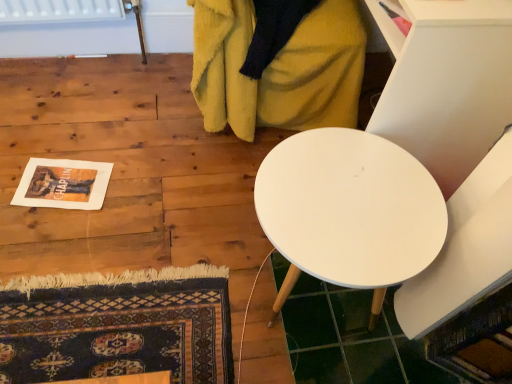
Question: From a real-world perspective, is white matte table at center beneath white matte table at upper right?

Choices:
 (A) yes
 (B) no

Answer: (A)

Question: Is white matte table at center turned away from white matte table at upper right?

Choices:
 (A) yes
 (B) no

Answer: (B)

Question: Does white matte table at center have a larger size compared to white matte table at upper right?

Choices:
 (A) yes
 (B) no

Answer: (B)

Question: Does white matte table at center appear on the right side of white matte table at upper right?

Choices:
 (A) yes
 (B) no

Answer: (B)

Question: Is white matte table at center positioned behind white matte table at upper right?

Choices:
 (A) yes
 (B) no

Answer: (B)

Question: Does point (448, 170) appear closer or farther from the camera than point (347, 49)?

Choices:
 (A) closer
 (B) farther

Answer: (A)

Question: From their relative heights in the image, would you say white matte table at upper right is taller or shorter than soft yellow blanket at upper center?

Choices:
 (A) tall
 (B) short

Answer: (A)

Question: From the image's perspective, is white matte table at upper right located above or below soft yellow blanket at upper center?

Choices:
 (A) above
 (B) below

Answer: (B)

Question: Considering the positions of white matte table at upper right and soft yellow blanket at upper center in the image, is white matte table at upper right wider or thinner than soft yellow blanket at upper center?

Choices:
 (A) thin
 (B) wide

Answer: (A)

Question: Is white matte table at center in front of or behind white matte table at upper right in the image?

Choices:
 (A) front
 (B) behind

Answer: (A)

Question: Is white matte table at center bigger or smaller than white matte table at upper right?

Choices:
 (A) big
 (B) small

Answer: (B)

Question: Is white matte table at center wider or thinner than white matte table at upper right?

Choices:
 (A) thin
 (B) wide

Answer: (A)

Question: Based on their positions, is white matte table at center located to the left or right of white matte table at upper right?

Choices:
 (A) right
 (B) left

Answer: (B)

Question: From a real-world perspective, is white matte table at upper right positioned above or below white matte table at center?

Choices:
 (A) below
 (B) above

Answer: (B)

Question: In terms of width, does white matte table at upper right look wider or thinner when compared to white matte table at center?

Choices:
 (A) wide
 (B) thin

Answer: (A)